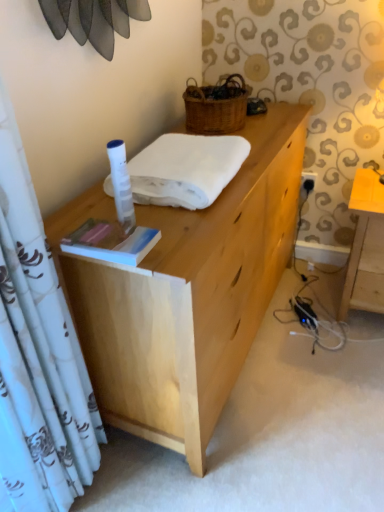
Question: Is hardcover book at center in front of or behind white soft towel at center in the image?

Choices:
 (A) behind
 (B) front

Answer: (B)

Question: From a real-world perspective, is hardcover book at center above or below white soft towel at center?

Choices:
 (A) above
 (B) below

Answer: (B)

Question: Which of these objects is positioned farthest from the light brown wooden table at right?

Choices:
 (A) natural wood desk at center
 (B) woven brown picnic basket at upper center
 (C) white plastic power outlet at lower right
 (D) hardcover book at center
 (E) white soft towel at center

Answer: (D)

Question: Based on their relative distances, which object is farther from the light brown wooden table at right?

Choices:
 (A) white soft towel at center
 (B) white plastic power outlet at lower right
 (C) hardcover book at center
 (D) natural wood desk at center
 (E) woven brown picnic basket at upper center

Answer: (C)